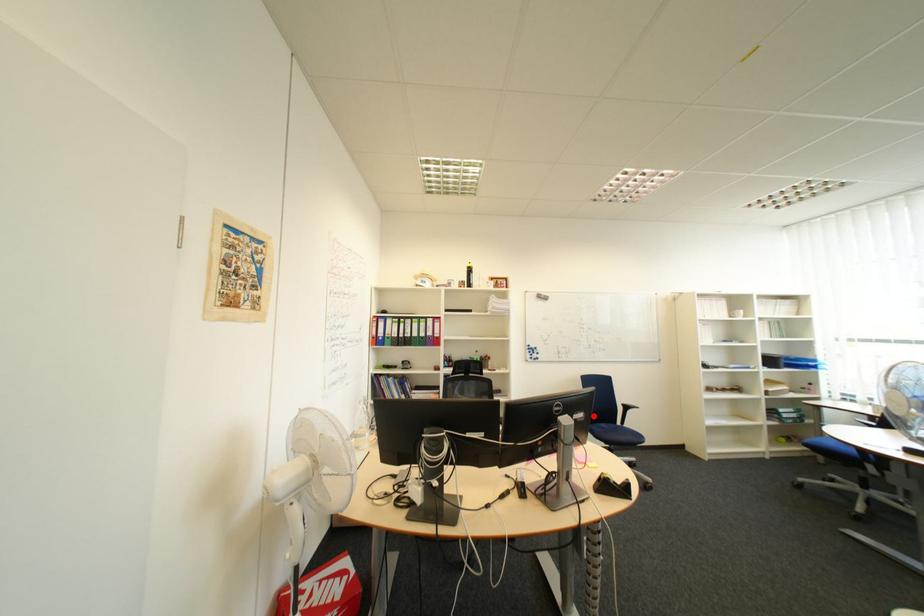
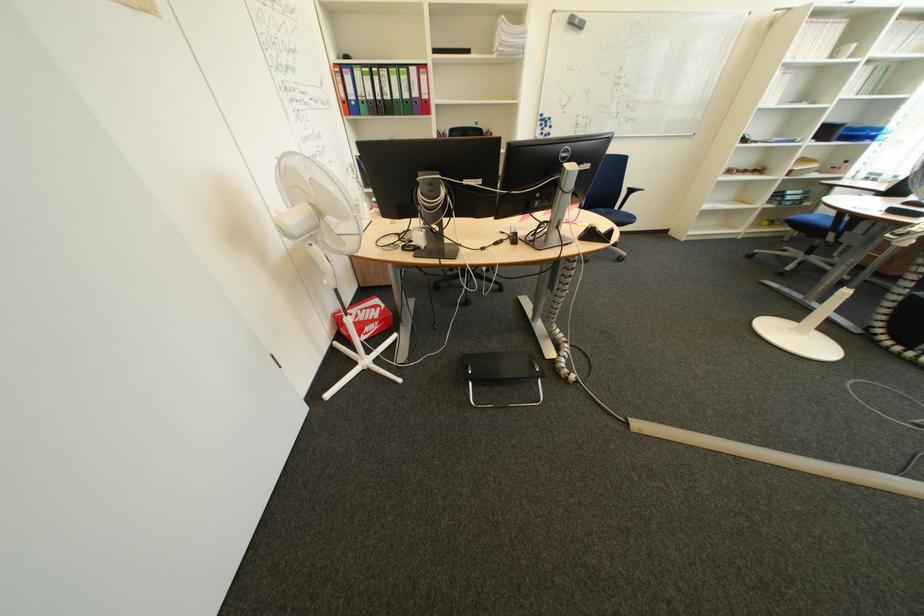
The point at the highlighted location is marked in the first image. Where is the corresponding point in the second image?

(601, 168)